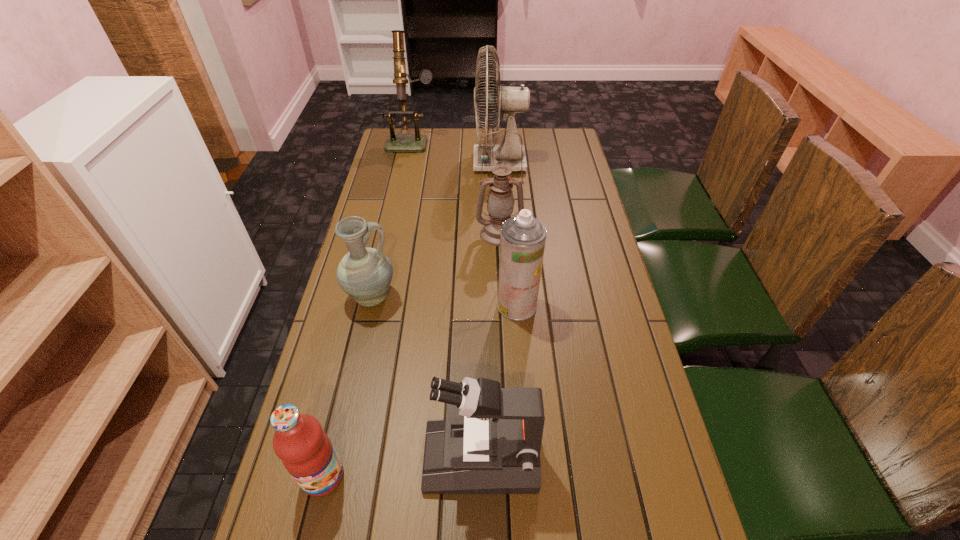
Where is `vacant position located on the front-facing side of the fan`? The image size is (960, 540). vacant position located on the front-facing side of the fan is located at coordinates (399, 163).

At what (x,y) coordinates should I click in order to perform the action: click on vacant space located on the front-facing side of the fan. Please return your answer as a coordinate pair (x, y). Image resolution: width=960 pixels, height=540 pixels. Looking at the image, I should click on (399, 163).

Locate an element on the screen. This screenshot has width=960, height=540. vacant position located 0.240m at the eyepiece of the taller microscope is located at coordinates pos(401,188).

The image size is (960, 540). In order to click on free space located 0.190m on the front of the oil lamp in this screenshot , I will do `click(502, 292)`.

Image resolution: width=960 pixels, height=540 pixels. Find the location of `free location located on the front of the aerosol can`. free location located on the front of the aerosol can is located at coordinates (523, 388).

What are the coordinates of `vacant region located 0.250m through the eyepieces of the shorter microscope` in the screenshot? It's located at (305, 456).

Find the location of a particular element. This screenshot has width=960, height=540. free region located 0.210m through the eyepieces of the shorter microscope is located at coordinates (324, 456).

Where is `vacant space situated through the eyepieces of the shorter microscope`? vacant space situated through the eyepieces of the shorter microscope is located at coordinates (377, 456).

The image size is (960, 540). I want to click on free space located on the handle side of the pitcher, so click(x=501, y=298).

Locate an element on the screen. The height and width of the screenshot is (540, 960). fan that is positioned at the far edge is located at coordinates (509, 100).